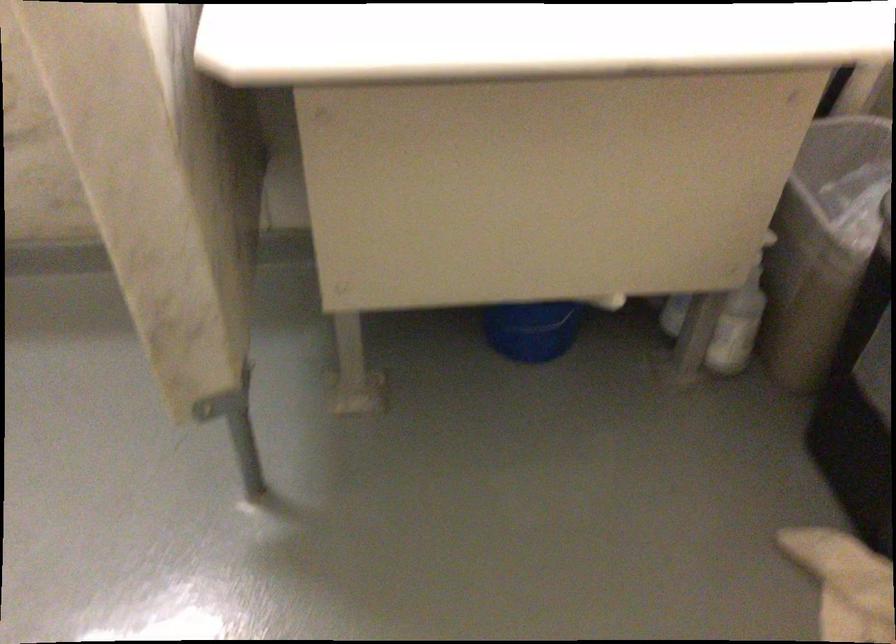
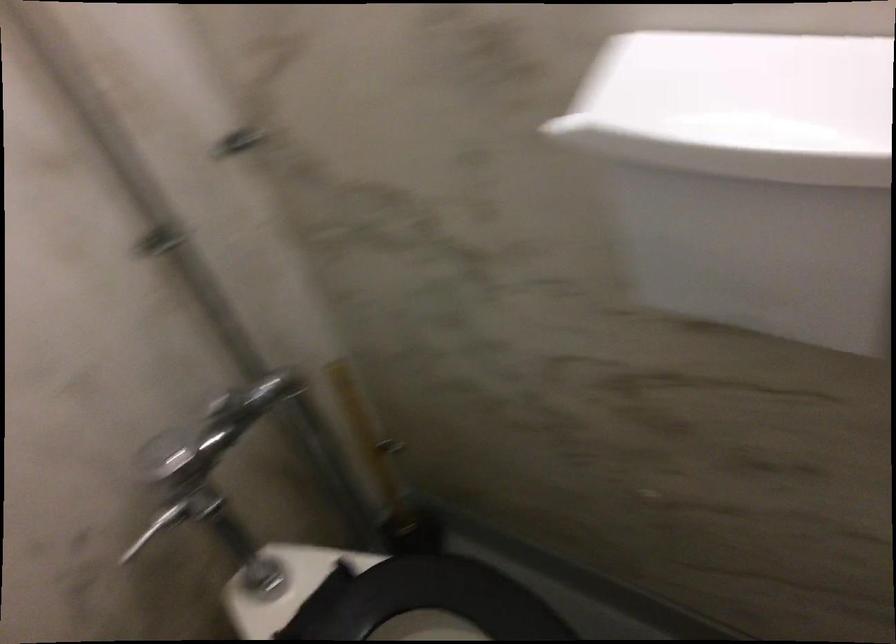
Question: The first image is from the beginning of the video and the second image is from the end. How did the camera likely rotate when shooting the video?

Choices:
 (A) Left
 (B) Right
 (C) Up
 (D) Down

Answer: (A)